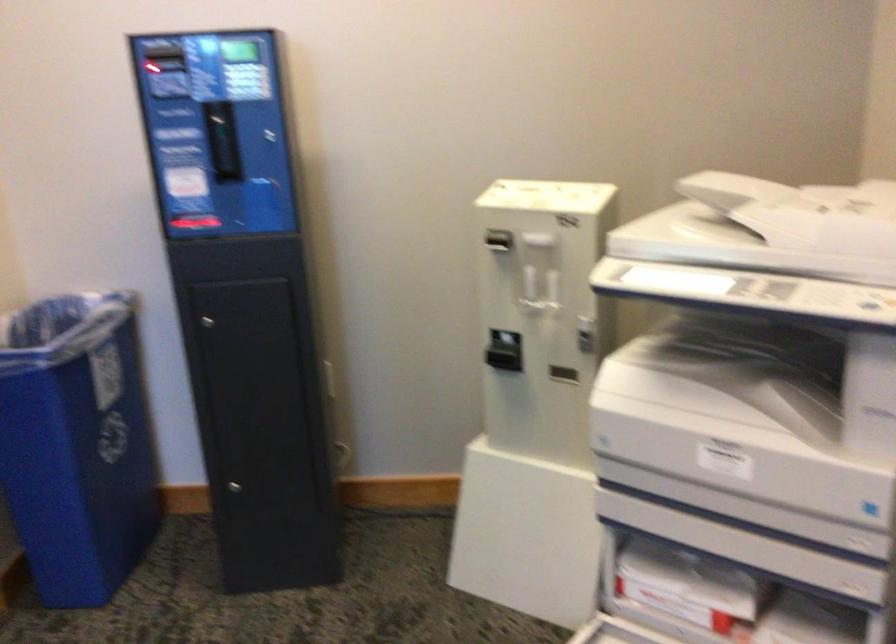
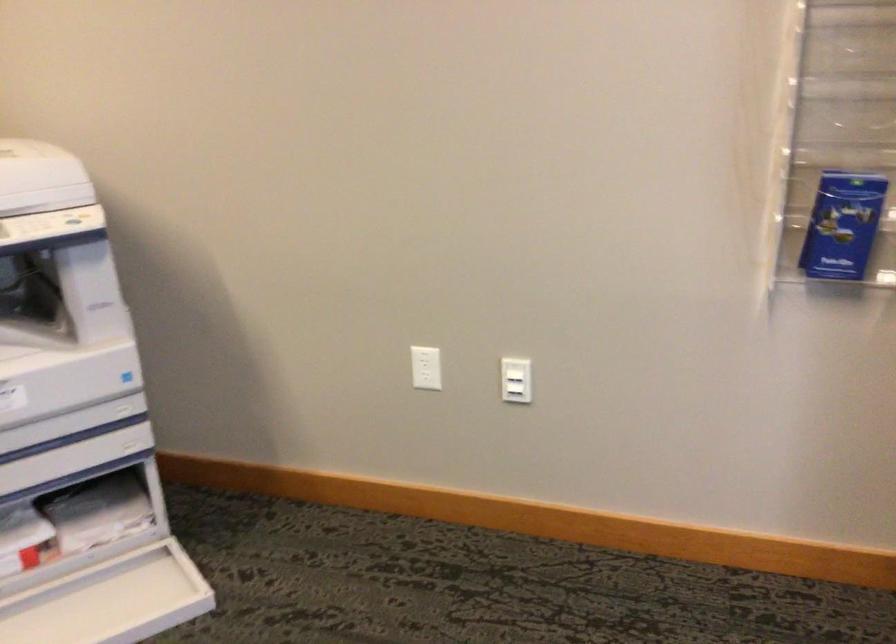
Question: The camera is either moving clockwise (left) or counter-clockwise (right) around the object. The first image is from the beginning of the video and the second image is from the end. Is the camera moving left or right when shooting the video?

Choices:
 (A) Left
 (B) Right

Answer: (A)